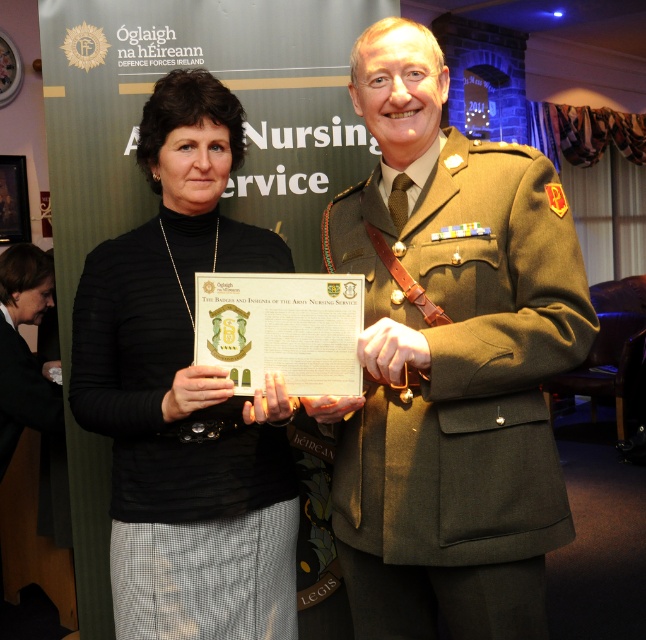
What is located at the point with coordinates [450,362] in the image?

The point at coordinates [450,362] is occupied by a matte olive green uniform at center.